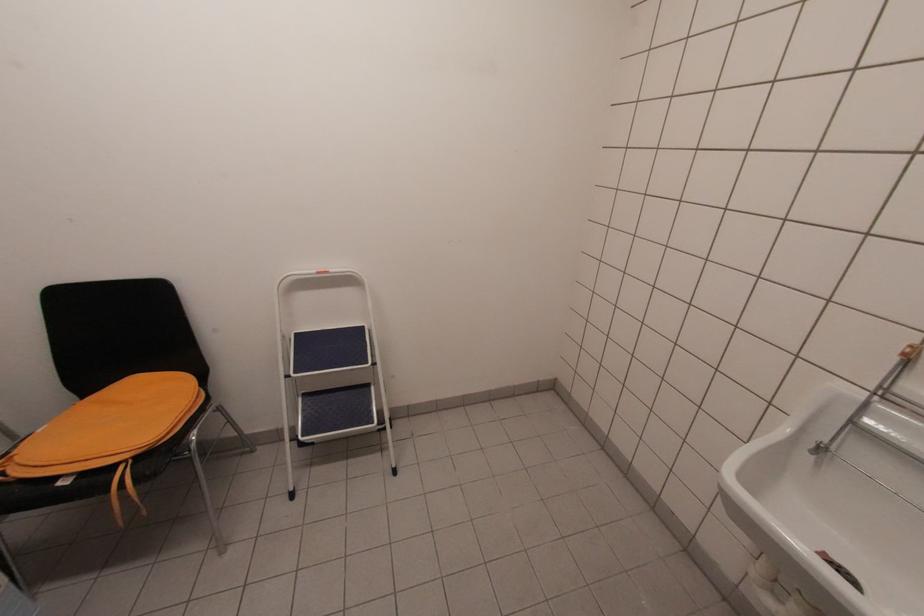
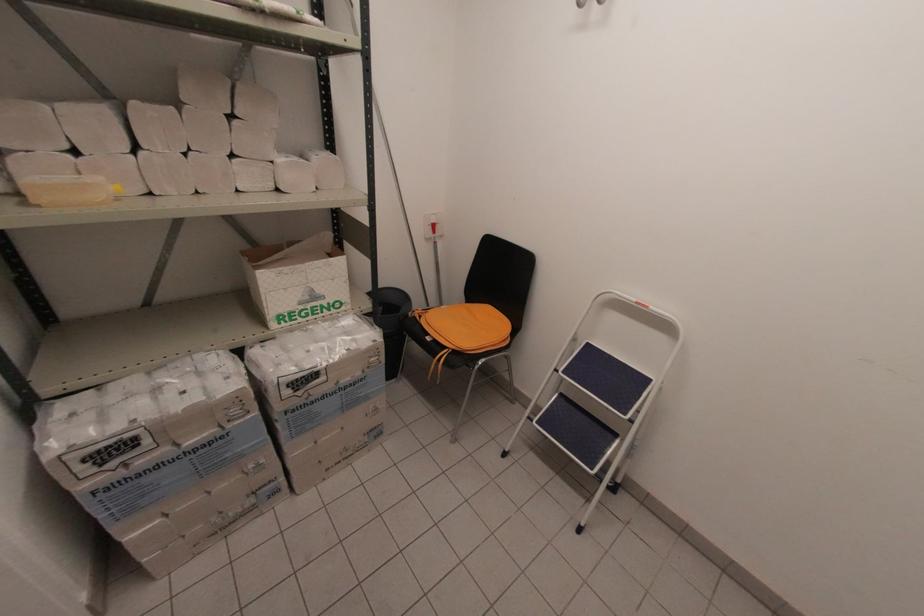
Where in the second image is the point corresponding to (297,334) from the first image?

(589, 344)